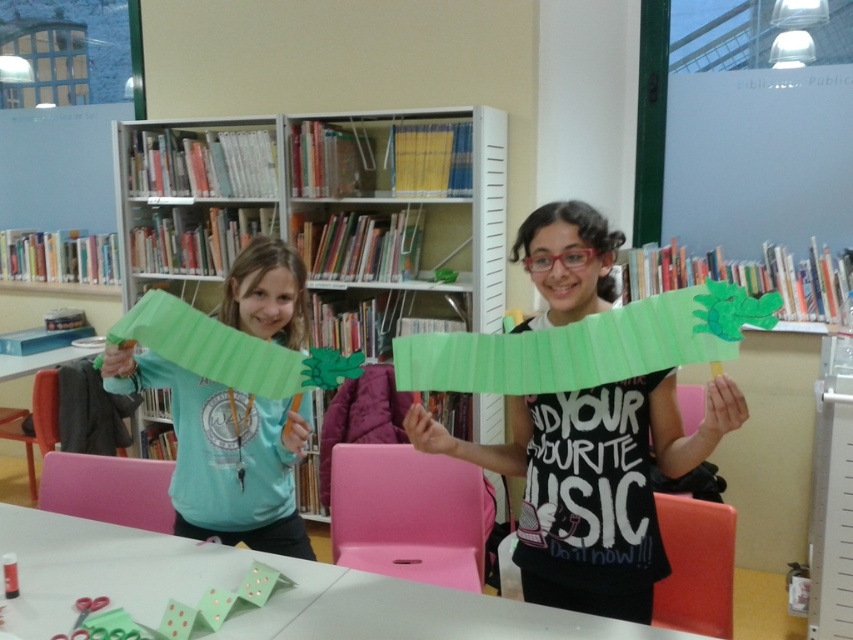
Which is above, matte cardboard bookcase at center or green paper craft at center?

matte cardboard bookcase at center is above.

Between point (380, 317) and point (650, 579), which one is positioned behind?

Point (380, 317)

Which is behind, point (498, 253) or point (573, 525)?

The point (498, 253) is more distant.

Locate an element on the screen. The width and height of the screenshot is (853, 640). matte cardboard bookcase at center is located at coordinates (328, 212).

Between point (160, 177) and point (270, 436), which one is positioned in front?

Positioned in front is point (270, 436).

Which is above, matte cardboard bookcase at center or matte green paper dragon at left?

matte cardboard bookcase at center

Does point (308, 179) come in front of point (170, 492)?

No, it is not.

Identify the location of matte cardboard bookcase at center. The height and width of the screenshot is (640, 853). (328, 212).

Can you confirm if green paper craft at center is thinner than white matte table at lower center?

Yes.

Does green paper craft at center have a lesser height compared to white matte table at lower center?

No, green paper craft at center is not shorter than white matte table at lower center.

The width and height of the screenshot is (853, 640). I want to click on green paper craft at center, so click(x=592, y=483).